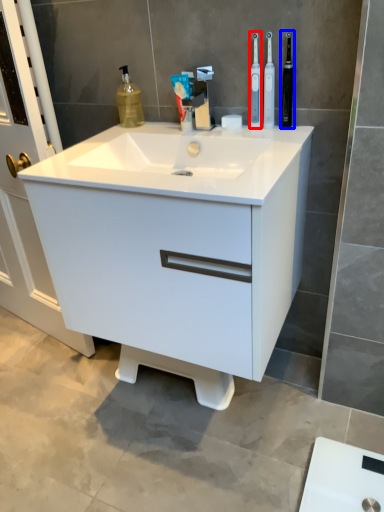
Question: Which of the following is the closest to the observer, toothbrush (highlighted by a red box) or toiletry (highlighted by a blue box)?

Choices:
 (A) toothbrush
 (B) toiletry

Answer: (B)